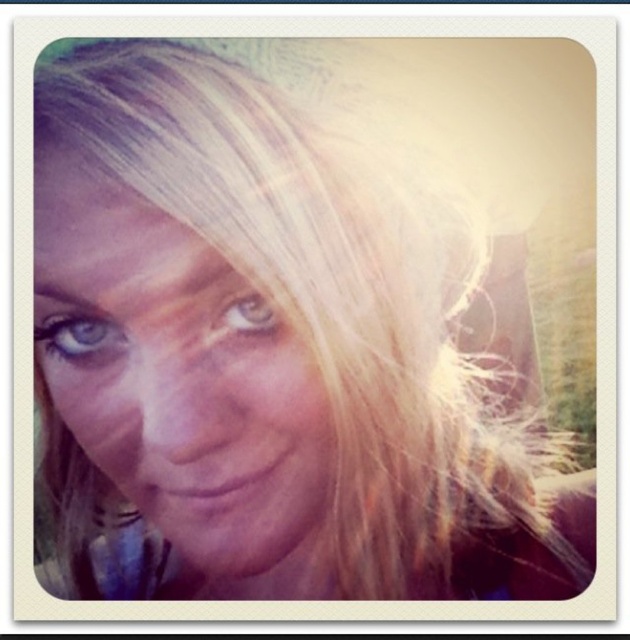
Question: Which point appears farthest from the camera in this image?

Choices:
 (A) (115, 248)
 (B) (241, 300)

Answer: (B)

Question: Can you confirm if smooth skin face at center is smaller than brown matte eye at center?

Choices:
 (A) yes
 (B) no

Answer: (B)

Question: Is smooth skin face at center positioned before blue matte eye at upper left?

Choices:
 (A) no
 (B) yes

Answer: (B)

Question: Which of the following is the farthest from the observer?

Choices:
 (A) smooth skin face at center
 (B) brown matte eye at center
 (C) blue matte eye at upper left

Answer: (C)

Question: Can you confirm if blue matte eye at upper left is positioned above brown matte eye at center?

Choices:
 (A) no
 (B) yes

Answer: (A)

Question: Estimate the real-world distances between objects in this image. Which object is closer to the blue matte eye at upper left?

Choices:
 (A) brown matte eye at center
 (B) smooth skin face at center

Answer: (B)